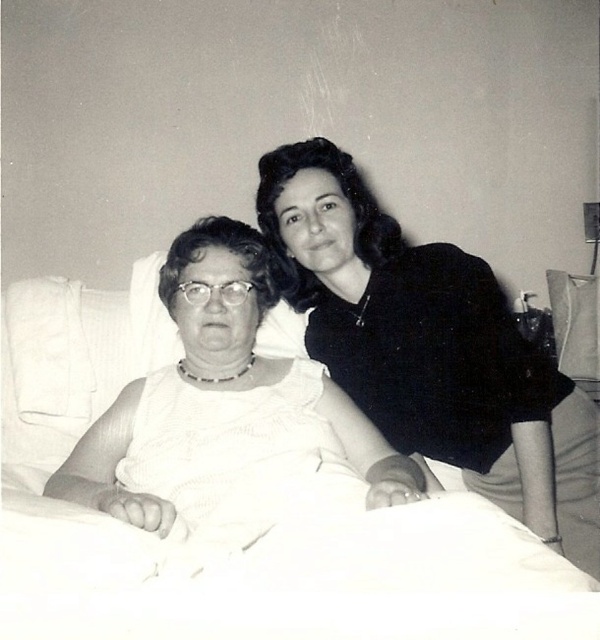
Question: Is white fabric at upper right bigger than white fabric at center?

Choices:
 (A) yes
 (B) no

Answer: (A)

Question: Can you confirm if white fabric hospital bed at center is smaller than white fabric at center?

Choices:
 (A) no
 (B) yes

Answer: (A)

Question: Which object appears closest to the camera in this image?

Choices:
 (A) white fabric at center
 (B) white fabric at upper right
 (C) white fabric hospital bed at center

Answer: (C)

Question: Is white fabric hospital bed at center below white fabric at center?

Choices:
 (A) no
 (B) yes

Answer: (B)

Question: Based on their relative distances, which object is nearer to the white fabric hospital bed at center?

Choices:
 (A) white fabric at upper right
 (B) white fabric at center

Answer: (B)

Question: Which of the following is the farthest from the observer?

Choices:
 (A) (214, 342)
 (B) (286, 321)
 (C) (546, 452)

Answer: (B)